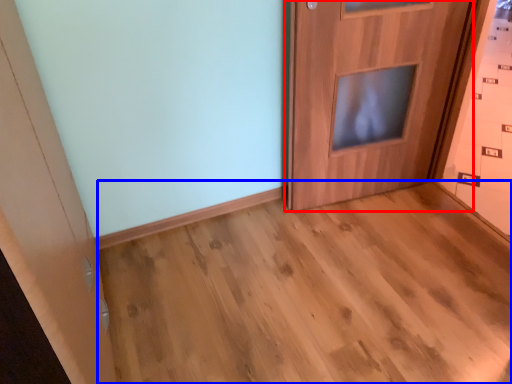
Question: Which of the following is the closest to the observer, door (highlighted by a red box) or corridor (highlighted by a blue box)?

Choices:
 (A) door
 (B) corridor

Answer: (B)